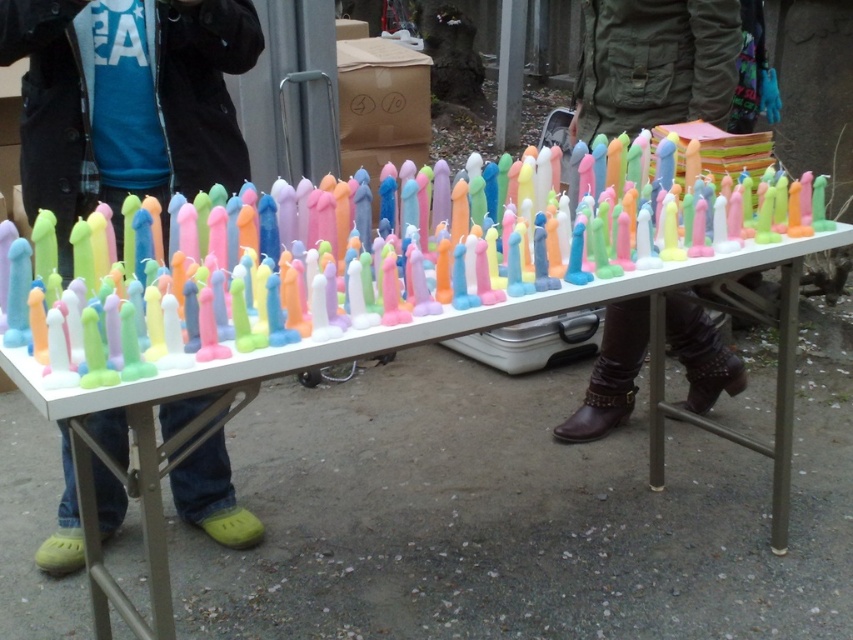
Question: Which object is positioned farthest from the brown leather boots at lower center?

Choices:
 (A) pastel wax candles at center
 (B) white plastic table at center
 (C) matte plastic toy at left

Answer: (C)

Question: Does matte plastic toy at left have a greater width compared to brown leather boots at lower center?

Choices:
 (A) no
 (B) yes

Answer: (B)

Question: Which of the following is the farthest from the observer?

Choices:
 (A) white plastic table at center
 (B) brown leather boots at lower center

Answer: (B)

Question: Does matte plastic toy at left come behind brown leather boots at lower center?

Choices:
 (A) no
 (B) yes

Answer: (A)

Question: Does matte plastic toy at left come in front of brown leather boots at lower center?

Choices:
 (A) no
 (B) yes

Answer: (B)

Question: Estimate the real-world distances between objects in this image. Which object is farther from the matte plastic toy at left?

Choices:
 (A) pastel wax candles at center
 (B) white plastic table at center
 (C) brown leather boots at lower center

Answer: (C)